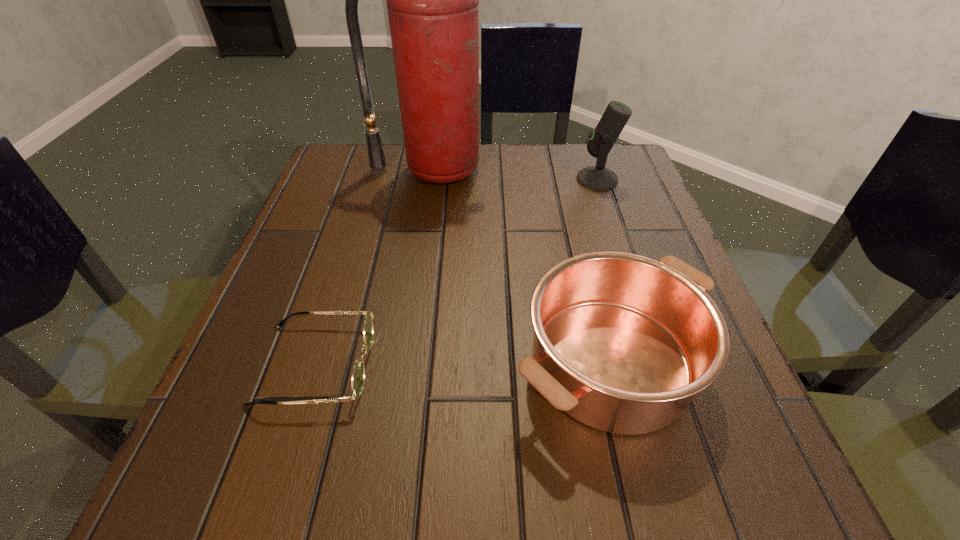
In order to click on free space between the spectacles and the saucepan in this screenshot , I will do `click(463, 363)`.

The width and height of the screenshot is (960, 540). I want to click on free space between the tallest object and the third tallest object, so point(521,266).

Identify which object is located as the second nearest to the saucepan. Please provide its 2D coordinates. Your answer should be formatted as a tuple, i.e. [(x, y)], where the tuple contains the x and y coordinates of a point satisfying the conditions above.

[(432, 0)]

Identify which object is the third closest to the saucepan. Please provide its 2D coordinates. Your answer should be formatted as a tuple, i.e. [(x, y)], where the tuple contains the x and y coordinates of a point satisfying the conditions above.

[(602, 139)]

Image resolution: width=960 pixels, height=540 pixels. In order to click on vacant area that satisfies the following two spatial constraints: 1. at the front of the fire extinguisher where the nozzle is aimed; 2. on the right side of the third tallest object in this screenshot , I will do `click(403, 362)`.

Find the location of a particular element. The width and height of the screenshot is (960, 540). free space that satisfies the following two spatial constraints: 1. at the front of the fire extinguisher where the nozzle is aimed; 2. on the lenses of the spectacles is located at coordinates (403, 364).

Where is `vacant region that satisfies the following two spatial constraints: 1. at the front of the fire extinguisher where the nozzle is aimed; 2. on the left side of the third tallest object`? The width and height of the screenshot is (960, 540). vacant region that satisfies the following two spatial constraints: 1. at the front of the fire extinguisher where the nozzle is aimed; 2. on the left side of the third tallest object is located at coordinates (403, 362).

Find the location of a particular element. blank area in the image that satisfies the following two spatial constraints: 1. at the front of the tallest object where the nozzle is aimed; 2. on the right side of the second tallest object is located at coordinates pyautogui.click(x=430, y=179).

Identify the location of vacant point that satisfies the following two spatial constraints: 1. on the front side of the third shortest object; 2. on the lenses of the shortest object. Image resolution: width=960 pixels, height=540 pixels. (660, 364).

Identify the location of blank area in the image that satisfies the following two spatial constraints: 1. on the front side of the saucepan; 2. on the lenses of the spectacles. (612, 364).